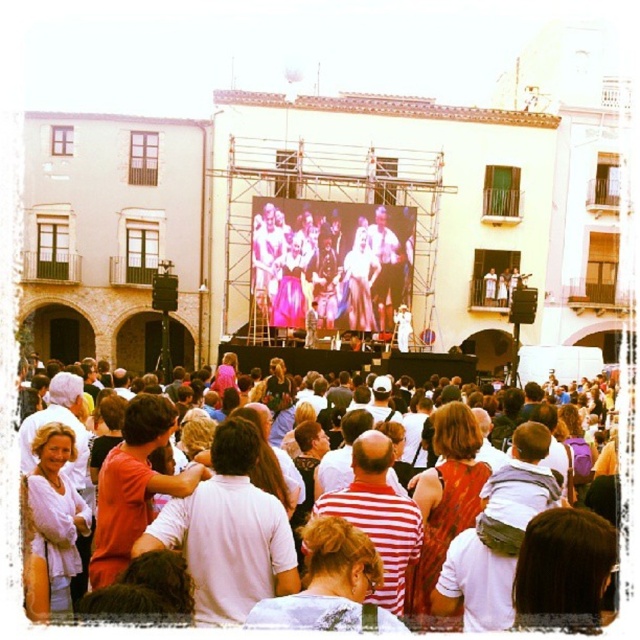
Question: Which object is closer to the camera taking this photo?

Choices:
 (A) matte pink dress at center
 (B) white cotton crowd at center

Answer: (B)

Question: Is matte pink dress at center to the left of white cotton crowd at center from the viewer's perspective?

Choices:
 (A) yes
 (B) no

Answer: (A)

Question: Is matte pink dress at center below white cotton crowd at center?

Choices:
 (A) yes
 (B) no

Answer: (B)

Question: Considering the relative positions of matte pink dress at center and white cotton crowd at center in the image provided, where is matte pink dress at center located with respect to white cotton crowd at center?

Choices:
 (A) right
 (B) left

Answer: (B)

Question: Which object is closer to the camera taking this photo?

Choices:
 (A) white cotton crowd at center
 (B) matte pink dress at center

Answer: (A)